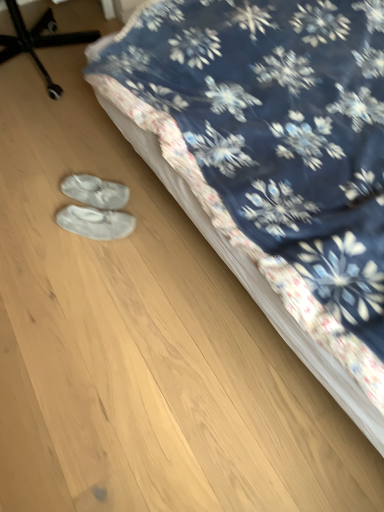
Where is `vacant space that's between white fabric shoe covers at lower left, arranged as the second footwear when ordered from the bottom, and white suede slippers at lower center, which is the second footwear from top to bottom`? The height and width of the screenshot is (512, 384). vacant space that's between white fabric shoe covers at lower left, arranged as the second footwear when ordered from the bottom, and white suede slippers at lower center, which is the second footwear from top to bottom is located at coordinates (129, 214).